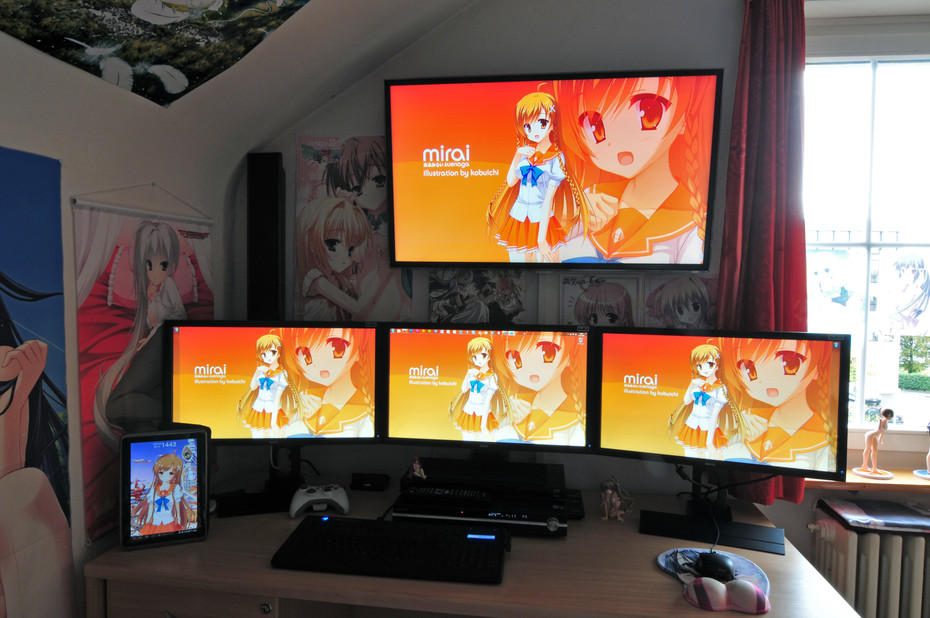
Where is `table`? The image size is (930, 618). table is located at coordinates (552, 556).